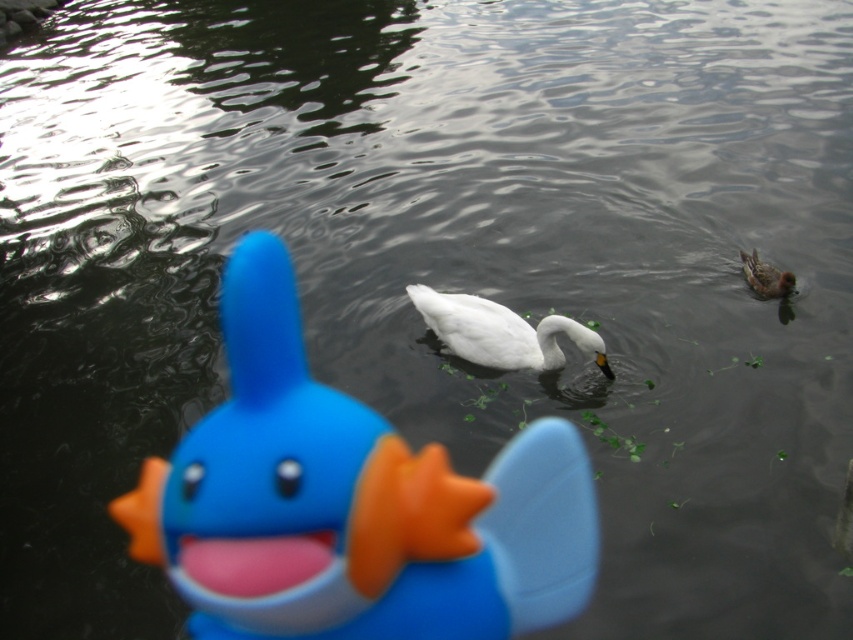
You have a small toy box that can only fit items narrower than the white matte swan at center. Can the rubber duck at center fit into the toy box?

The rubber duck at center is narrower than the white matte swan at center, so it can fit into the toy box.

You are a photographer trying to capture the white matte swan at center and the brown speckled feathers at upper right in a single shot. Based on their sizes, which one would appear larger in your photo?

The white matte swan at center appears larger in the photo because it is much taller than the brown speckled feathers at upper right.